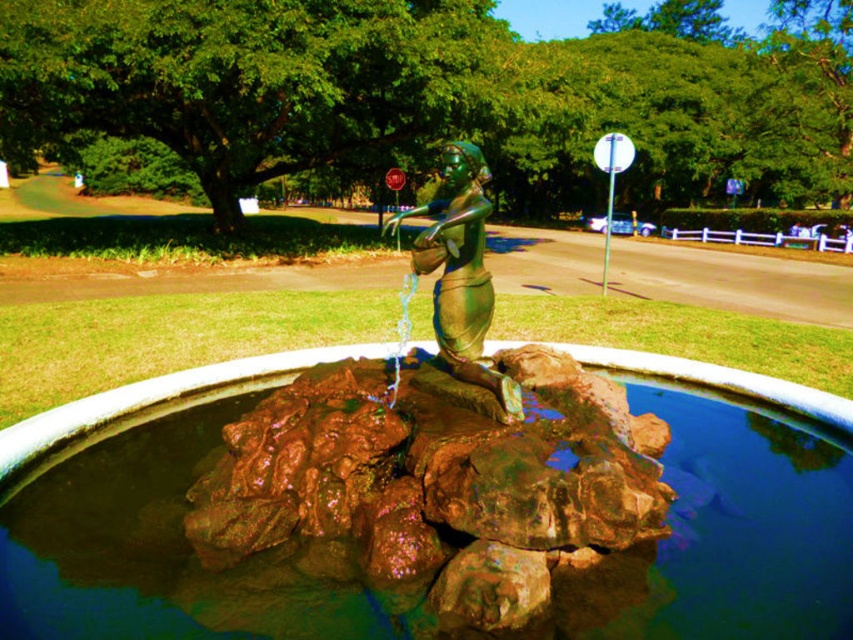
You are a photographer standing at the edge of the fountain. You want to capture a closeup of the green patina bronze figurine at center without the brown stone water at center appearing in the frame. Is this possible given their sizes?

The brown stone water at center is wider than the green patina bronze figurine at center. Since the water is wider, it might be challenging to frame the figurine without including some of the water in the shot, especially if you are close to the edge. Adjusting your angle or moving closer might help isolate the figurine, but the water being wider could still be visible depending on the lens used.

You are a maintenance worker tasked with cleaning the fountain. You have a 1.5 meter long pole. Can you safely reach the green patina bronze figurine at center from the brown stone water at center using the pole without getting too close to the water?

The distance between the brown stone water at center and the green patina bronze figurine at center is 1.31 meters. Since the pole is 1.5 meters long, it is long enough to reach the figurine from the water without needing to get too close. Therefore, you can safely clean the figurine using the pole.

You are standing at the edge of the fountain and want to place a small decorative statue exactly at the center of the brown stone water at center. According to the coordinates provided, where should you place it?

The brown stone water at center should be placed at coordinates point (x=416, y=515).